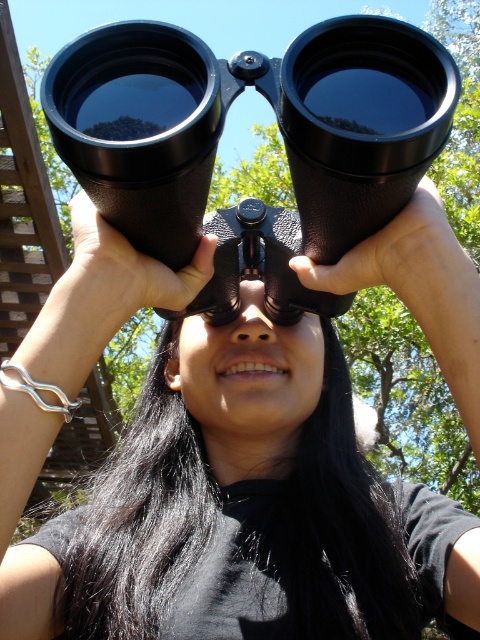
You are trying to decide which pair of binoculars to use for bird watching. You have two options in front of you at the center of the image. The first is the black matte binoculars at center, and the second is the black rubber binoculars at center. Based on their sizes, which one would you choose if you prefer a larger pair?

The black matte binoculars at center are larger in size than the black rubber binoculars at center, so you should choose the black matte binoculars at center for a larger pair.

You are trying to decide which pair of binoculars to use for bird watching. You notice the black matte binoculars at center and the black rubber binoculars at center. Which one is located to the left?

The black matte binoculars at center is positioned on the left side of black rubber binoculars at center, so the black matte binoculars at center is the one located to the left.